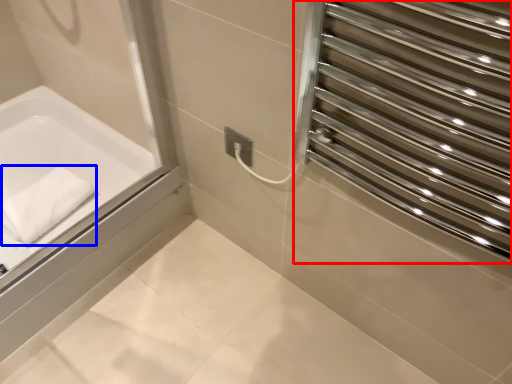
Question: Which object is closer to the camera taking this photo, screen door (highlighted by a red box) or bath towel (highlighted by a blue box)?

Choices:
 (A) screen door
 (B) bath towel

Answer: (A)